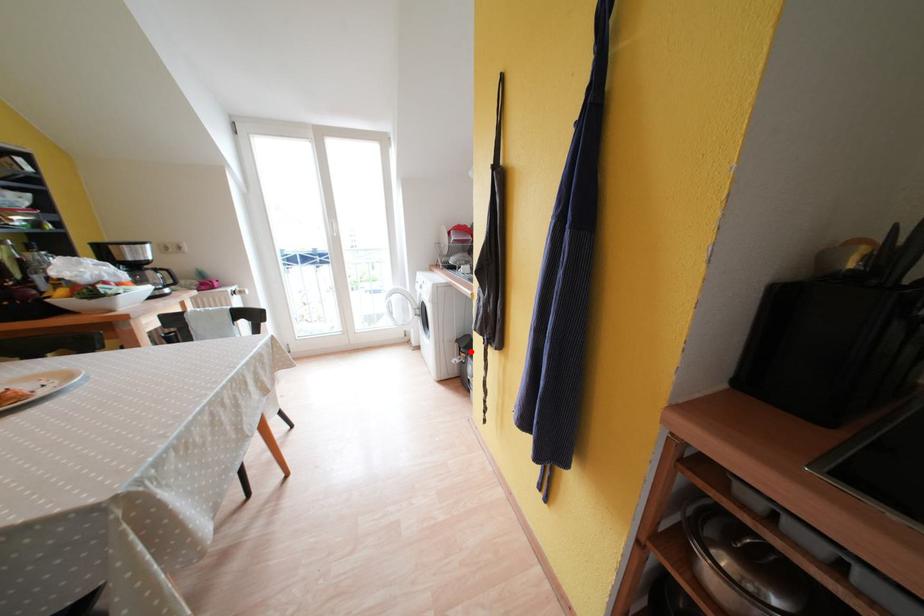
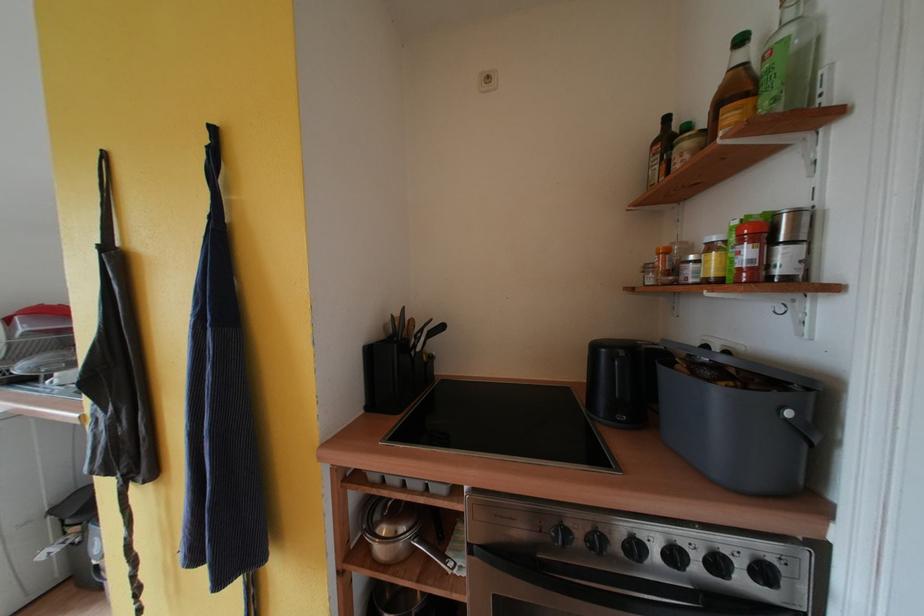
Question: I am providing you with two images of the same scene from different viewpoints. A red point is shown in image1. For the corresponding object point in image2, is it positioned nearer or farther from the camera?

Choices:
 (A) Nearer
 (B) Farther

Answer: (A)